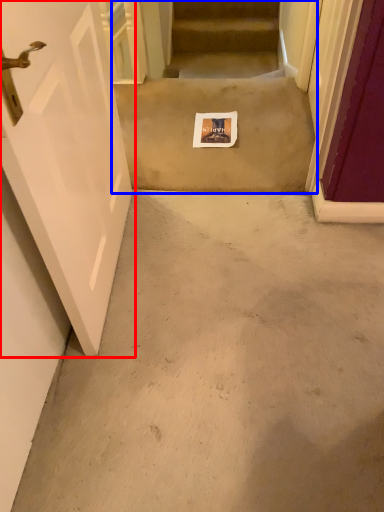
Question: Which point is further to the camera, door (highlighted by a red box) or escalator (highlighted by a blue box)?

Choices:
 (A) door
 (B) escalator

Answer: (B)